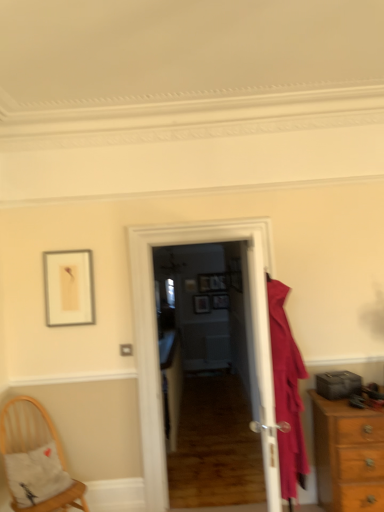
Question: Is matte gold picture frame at center, which is the first picture frame in left-to-right order, further to camera compared to woven wood chair at lower left?

Choices:
 (A) no
 (B) yes

Answer: (B)

Question: Could woven wood chair at lower left be considered to be inside matte gold picture frame at center, which is the first picture frame in left-to-right order?

Choices:
 (A) yes
 (B) no

Answer: (B)

Question: From a real-world perspective, is matte gold picture frame at center, arranged as the fourth picture frame when viewed from the right, physically below woven wood chair at lower left?

Choices:
 (A) no
 (B) yes

Answer: (A)

Question: Is matte gold picture frame at center, arranged as the fourth picture frame when viewed from the right, smaller than woven wood chair at lower left?

Choices:
 (A) no
 (B) yes

Answer: (B)

Question: Does matte gold picture frame at center, arranged as the fourth picture frame when viewed from the right, touch woven wood chair at lower left?

Choices:
 (A) yes
 (B) no

Answer: (B)

Question: In the image, is white glossy door at center, placed as the first door when sorted from back to front, positioned in front of or behind white glossy door at center, the first door from the front?

Choices:
 (A) front
 (B) behind

Answer: (B)

Question: Is white glossy door at center, which is counted as the 2th door, starting from the front, inside the boundaries of white glossy door at center, positioned as the 2th door in back-to-front order, or outside?

Choices:
 (A) inside
 (B) outside

Answer: (B)

Question: Considering the positions of white glossy door at center, placed as the first door when sorted from back to front, and white glossy door at center, positioned as the 2th door in back-to-front order, in the image, is white glossy door at center, placed as the first door when sorted from back to front, wider or thinner than white glossy door at center, positioned as the 2th door in back-to-front order,?

Choices:
 (A) thin
 (B) wide

Answer: (B)

Question: From the image's perspective, is white glossy door at center, placed as the first door when sorted from back to front, located above or below white glossy door at center, the first door from the front?

Choices:
 (A) below
 (B) above

Answer: (B)

Question: From the image's perspective, is wooden picture frame at center, arranged as the third picture frame when viewed from the left, located above or below matte wooden picture frame at center, placed as the 4th picture frame when sorted from left to right?

Choices:
 (A) below
 (B) above

Answer: (B)

Question: In terms of height, does wooden picture frame at center, which is the second picture frame from right to left, look taller or shorter compared to matte wooden picture frame at center, placed as the 4th picture frame when sorted from left to right?

Choices:
 (A) tall
 (B) short

Answer: (A)

Question: Relative to matte wooden picture frame at center, placed as the 4th picture frame when sorted from left to right, is wooden picture frame at center, which is the second picture frame from right to left, in front or behind?

Choices:
 (A) front
 (B) behind

Answer: (B)

Question: Is wooden picture frame at center, arranged as the third picture frame when viewed from the left, spatially inside matte wooden picture frame at center, placed as the 4th picture frame when sorted from left to right, or outside of it?

Choices:
 (A) inside
 (B) outside

Answer: (B)

Question: Based on their sizes in the image, would you say matte wooden picture frame at center, the second picture frame in the left-to-right sequence, is bigger or smaller than matte wooden picture frame at center, placed as the 4th picture frame when sorted from left to right?

Choices:
 (A) big
 (B) small

Answer: (B)

Question: Is matte wooden picture frame at center, the second picture frame in the left-to-right sequence, taller or shorter than matte wooden picture frame at center, which is the first picture frame from right to left?

Choices:
 (A) tall
 (B) short

Answer: (A)